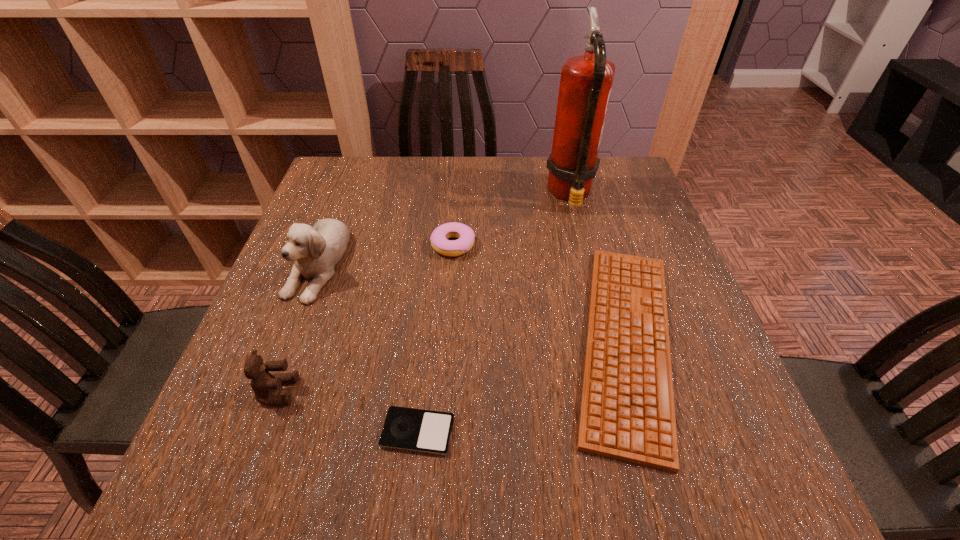
The image size is (960, 540). Find the location of `the farthest object`. the farthest object is located at coordinates (586, 80).

Identify the location of the tallest object. (586, 80).

Find the location of a particular element. The height and width of the screenshot is (540, 960). the fifth shortest object is located at coordinates (316, 250).

Where is `the fourth shortest object`? the fourth shortest object is located at coordinates (263, 383).

Find the location of a particular element. The height and width of the screenshot is (540, 960). doughnut is located at coordinates [x=439, y=240].

What are the coordinates of `computer keyboard` in the screenshot? It's located at (627, 413).

This screenshot has height=540, width=960. What are the coordinates of `iPod` in the screenshot? It's located at (417, 430).

Locate an element on the screen. vacant area located 0.270m at the nozzle of the fire extinguisher is located at coordinates (445, 194).

The height and width of the screenshot is (540, 960). Find the location of `vacant space located 0.210m at the nozzle of the fire extinguisher`. vacant space located 0.210m at the nozzle of the fire extinguisher is located at coordinates (468, 194).

Where is `vacant space located 0.160m at the nozzle of the fire extinguisher`? Image resolution: width=960 pixels, height=540 pixels. vacant space located 0.160m at the nozzle of the fire extinguisher is located at coordinates (486, 194).